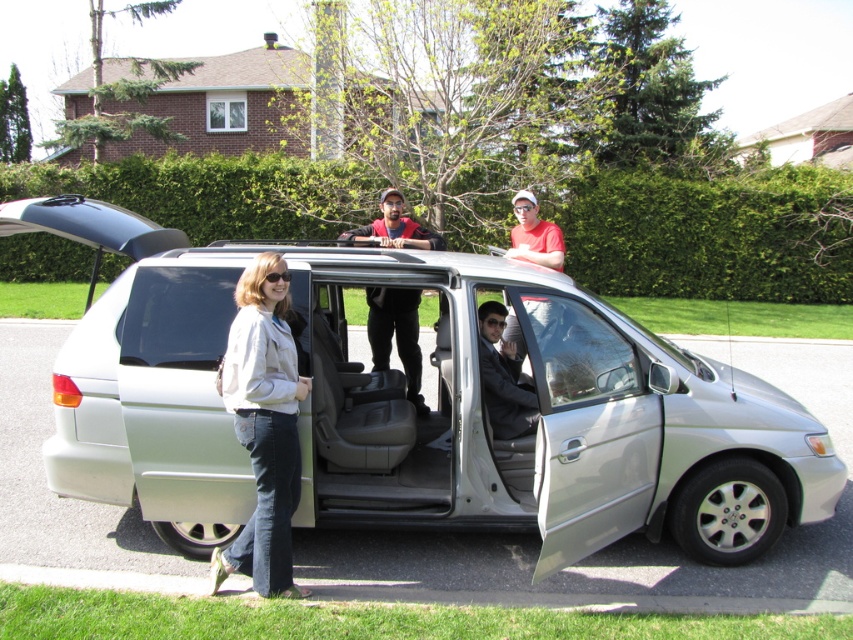
You are standing in front of the silver minivan with an object that is 2 meters long. You want to place it horizontally so that it reaches from the front of the van to the point marked at coordinates point (473, 262). Is this possible?

The point (473, 262) is 4.23 meters from the viewer. Since the object is only 2 meters long, it cannot reach from the front of the van to the point (473, 262) because the distance is greater than the object length.

You are a photographer standing in front of the silver minivan. You want to focus your camera on the point that is closer to you. Which point should you choose between point [305,406] and point [524,224]?

Point [305,406] is closer to the camera than point [524,224], so you should focus on point [305,406].